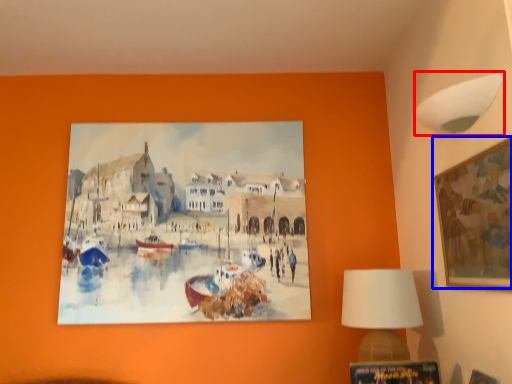
Question: Among these objects, which one is farthest to the camera, lamp (highlighted by a red box) or picture frame (highlighted by a blue box)?

Choices:
 (A) lamp
 (B) picture frame

Answer: (A)